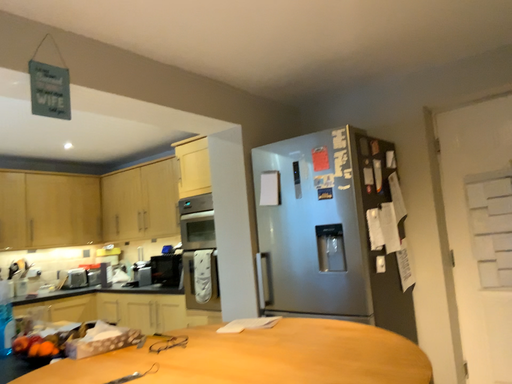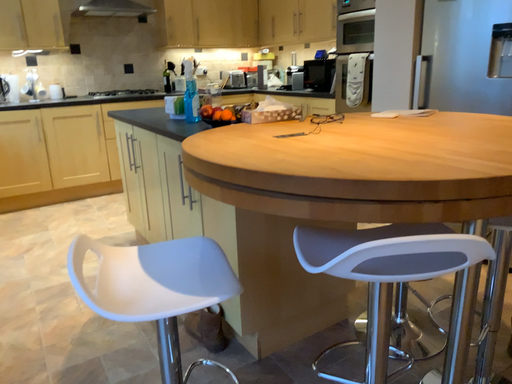
Question: Which way did the camera rotate in the video?

Choices:
 (A) rotated upward
 (B) rotated downward

Answer: (B)